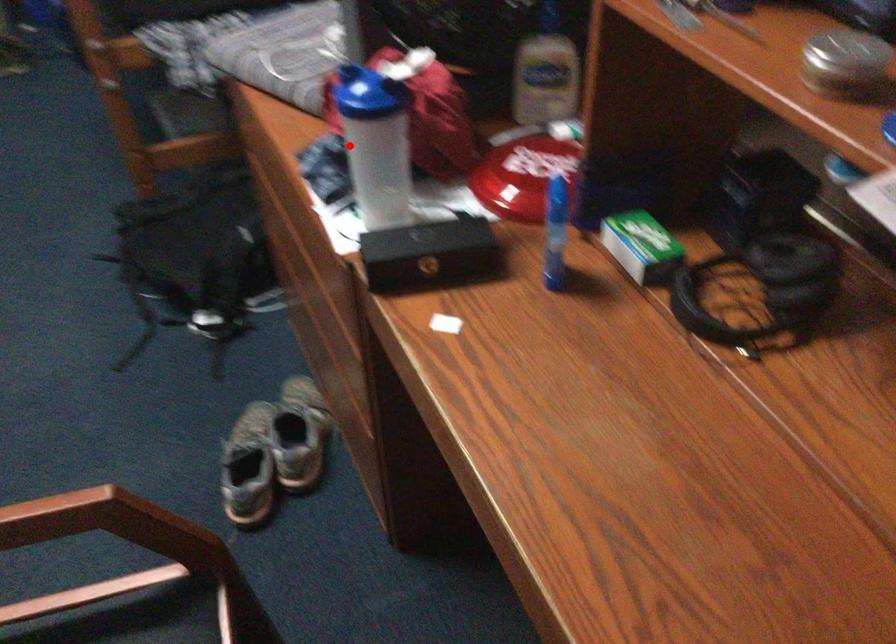
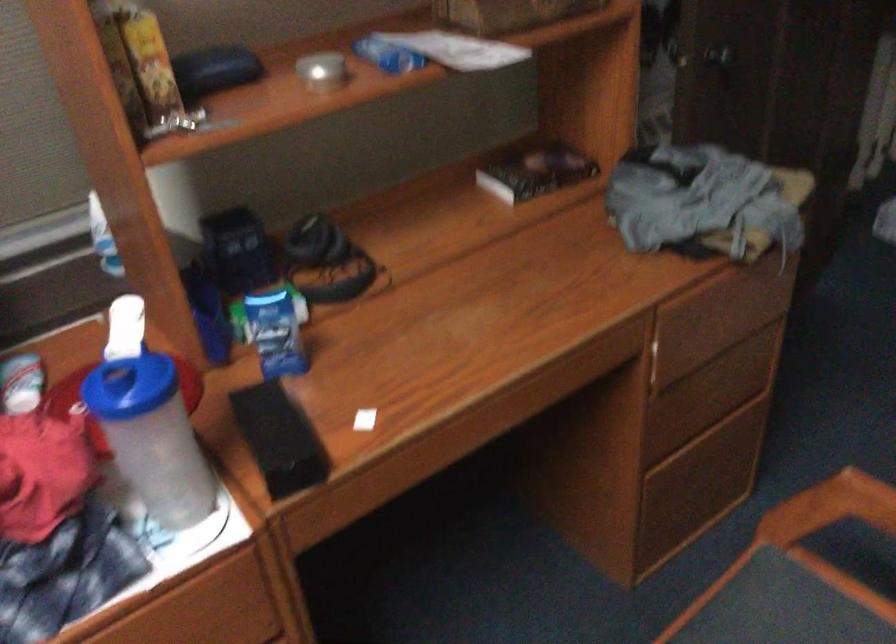
Question: I am providing you with two images of the same scene from different viewpoints. Image1 has a red point marked. In image2, the corresponding 3D location appears at what relative position? Reply with the corresponding letter.

Choices:
 (A) Closer
 (B) Farther

Answer: (A)